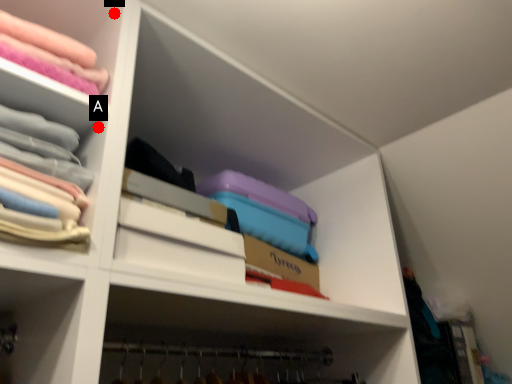
Question: Two points are circled on the image, labeled by A and B beside each circle. Which point is closer to the camera?

Choices:
 (A) A is closer
 (B) B is closer

Answer: (A)